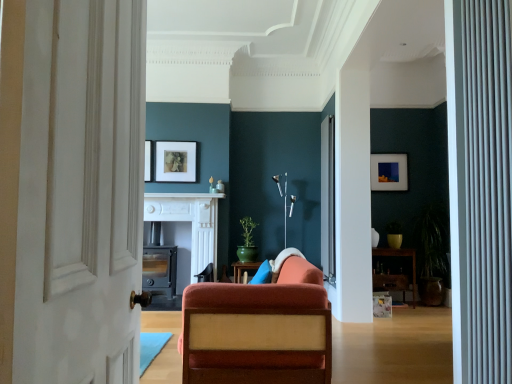
Question: Based on their sizes in the image, would you say wooden shelf at right is bigger or smaller than velvet orange chair at center?

Choices:
 (A) big
 (B) small

Answer: (B)

Question: Does point (392, 253) appear closer or farther from the camera than point (268, 306)?

Choices:
 (A) closer
 (B) farther

Answer: (B)

Question: Estimate the real-world distances between objects in this image. Which object is closer to the matte black wood-burning stove at center, acting as the 1th fireplace starting from the left?

Choices:
 (A) silver metallic radiator at right
 (B) white textured door at left
 (C) matte white picture frame at upper center, which appears as the first picture frame when viewed from the front
 (D) wooden shelf at right
 (E) green matte plant at right, the 1th houseplant positioned from the right

Answer: (C)

Question: Estimate the real-world distances between objects in this image. Which object is farther from the matte white picture frame at upper center, which ranks as the 2th picture frame in right-to-left order?

Choices:
 (A) velvet orange chair at center
 (B) silver metallic floor lamp at center
 (C) white textured curtain at right
 (D) wooden shelf at right
 (E) matte gray fireplace at center, arranged as the 2th fireplace when viewed from the left

Answer: (C)